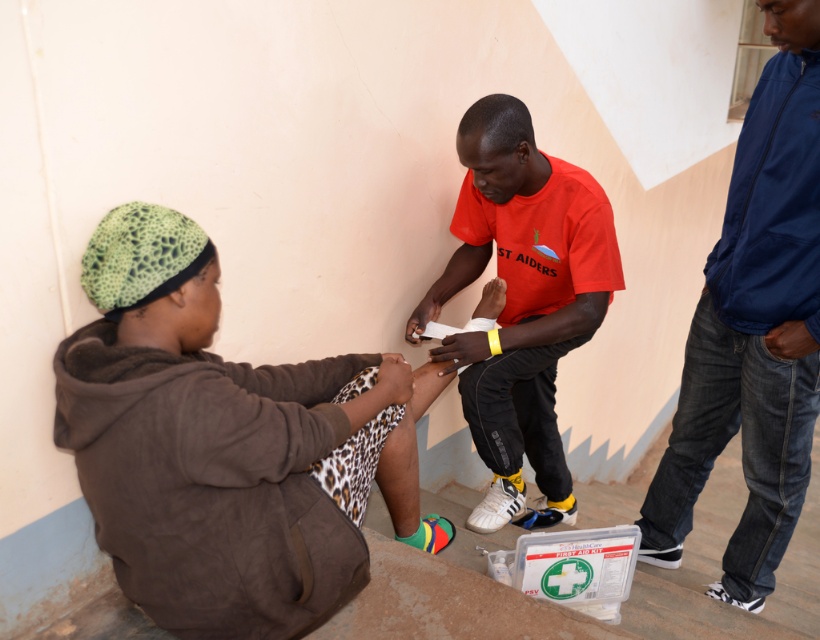
You are standing in the scene and want to place a small first aid kit between the two points labeled point (80, 461) and point (727, 378). Which point should the kit be closer to in order to be equidistant from both points?

The first aid kit should be placed closer to point (727, 378) because point (80, 461) is closer to the viewer than point (727, 378). To be equidistant, it needs to compensate for the difference in depth.

Where is the brown suede hoodie at lower left located in the image?

The brown suede hoodie at lower left is located at point (222, 444) in the image.

You are a first responder entering the room and need to quickly assess the situation. Which object is positioned lower in the scene, the brown suede hoodie at lower left or the blue jeans at right?

The brown suede hoodie at lower left is located below blue jeans at right, so it is positioned lower in the scene.